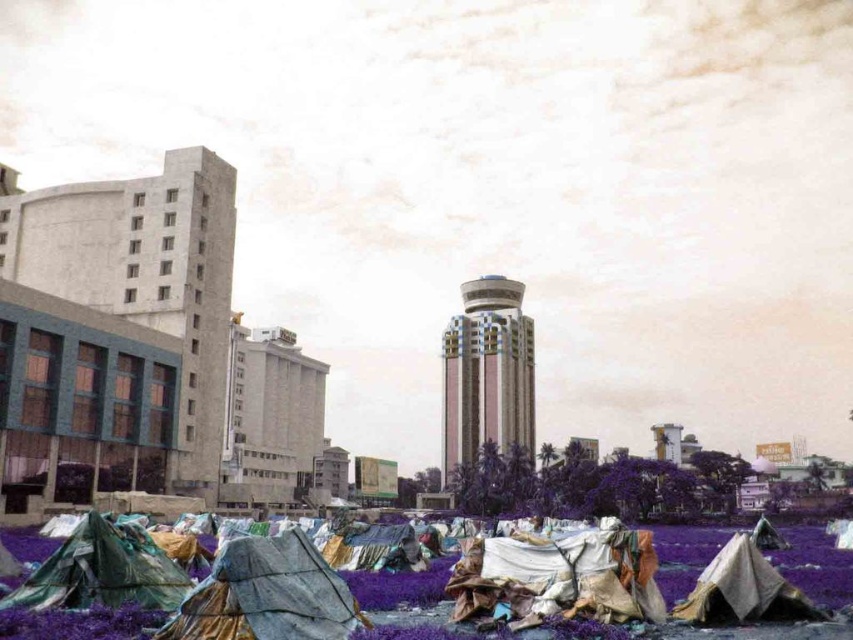
Question: Which point appears farthest from the camera in this image?

Choices:
 (A) (445, 371)
 (B) (292, 598)

Answer: (A)

Question: Does textured gray tarp at lower left have a smaller size compared to pink glossy tower at center?

Choices:
 (A) yes
 (B) no

Answer: (A)

Question: Where is textured gray tarp at lower left located in relation to pink glossy tower at center in the image?

Choices:
 (A) above
 (B) below

Answer: (A)

Question: Which point is farther to the camera?

Choices:
 (A) pink glossy tower at center
 (B) textured gray tarp at lower left

Answer: (A)

Question: Is the position of textured gray tarp at lower left more distant than that of pink glossy tower at center?

Choices:
 (A) yes
 (B) no

Answer: (B)

Question: Which of the following is the farthest from the observer?

Choices:
 (A) (496, 308)
 (B) (256, 589)

Answer: (A)